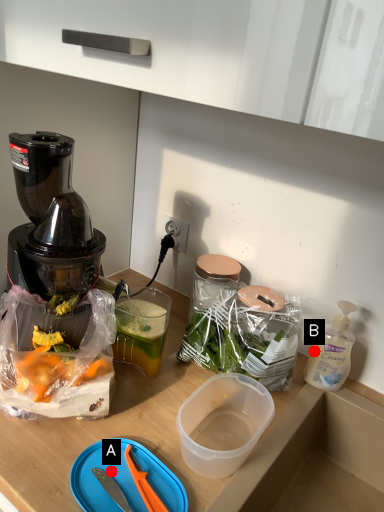
Question: Two points are circled on the image, labeled by A and B beside each circle. Which of the following is the farthest from the observer?

Choices:
 (A) A is further
 (B) B is further

Answer: (B)